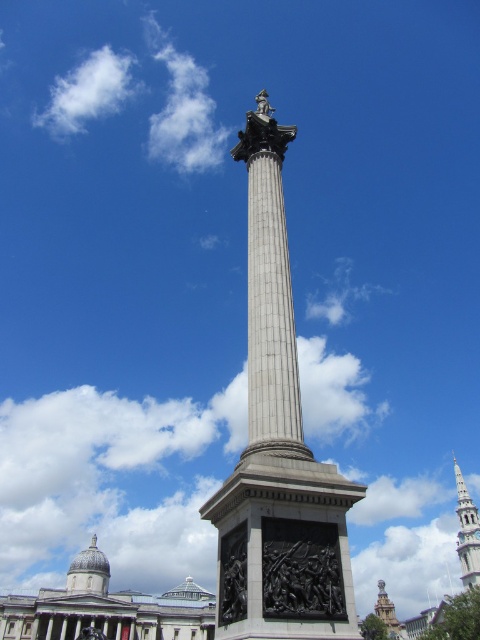
You are an architect designing a new city park and want to ensure that the gold textured tower at center will be visible from the observation deck of the white fluffy cloud at upper left. Based on the scene description, will the tower be visible from the cloud?

The white fluffy cloud at upper left is taller than the gold textured tower at center, so the tower will not be visible from the cloud because the cloud is higher up in the sky.

You are standing at the base of the monument and want to take a photo of the white fluffy cloud at upper left. If your camera can focus on objects up to 300 meters away, will you be able to capture the cloud clearly?

The white fluffy cloud at upper left and camera are 279.74 meters apart, so yes, the camera can focus on the white fluffy cloud at upper left since it is within the 300 meters range.